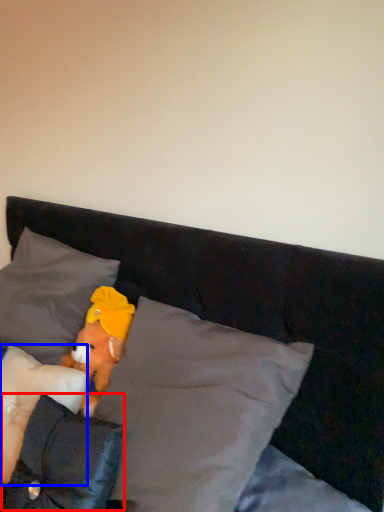
Question: Which object is closer to the camera taking this photo, pillow (highlighted by a red box) or pillow (highlighted by a blue box)?

Choices:
 (A) pillow
 (B) pillow

Answer: (A)